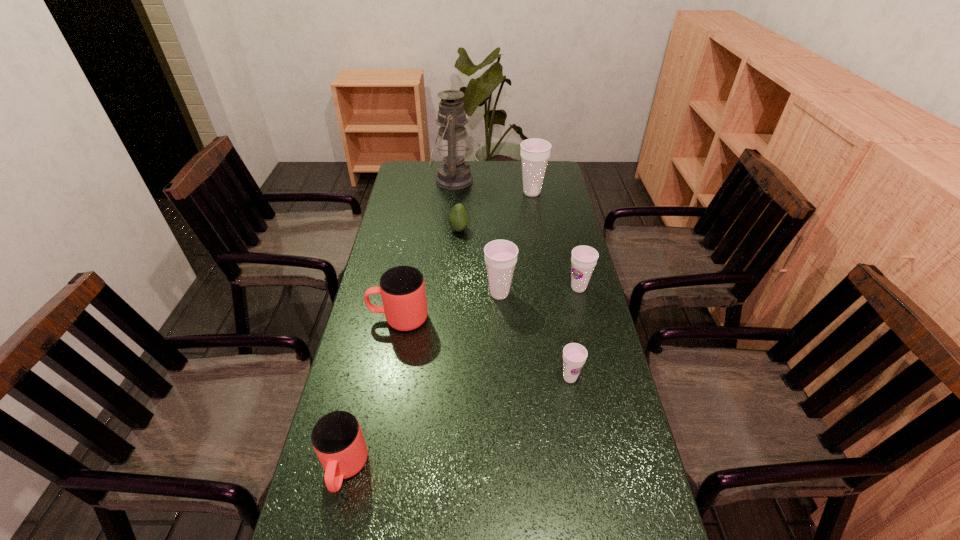
Identify the location of the third farthest object. The width and height of the screenshot is (960, 540). (458, 219).

Find the location of `the seventh farthest object`. the seventh farthest object is located at coordinates (574, 355).

Find the location of a particular element. The image size is (960, 540). the nearest purple cup is located at coordinates (574, 355).

This screenshot has width=960, height=540. Find the location of `free spot located on the right of the oil lamp`. free spot located on the right of the oil lamp is located at coordinates (540, 180).

Where is `vacant space located 0.350m on the left of the seventh shortest object`? This screenshot has width=960, height=540. vacant space located 0.350m on the left of the seventh shortest object is located at coordinates (436, 192).

I want to click on blank space located 0.070m on the back of the second biggest purple cup, so click(x=498, y=269).

The height and width of the screenshot is (540, 960). I want to click on vacant space located 0.080m on the back of the second smallest purple cup, so click(573, 264).

Identify the location of vacant area located on the handle side of the nearer pink cup. The height and width of the screenshot is (540, 960). (331, 528).

Identify the location of vacant region located 0.070m on the front of the avocado. The image size is (960, 540). (458, 247).

Where is `vacant space located 0.120m on the back of the nearest purple cup`? The height and width of the screenshot is (540, 960). vacant space located 0.120m on the back of the nearest purple cup is located at coordinates (563, 335).